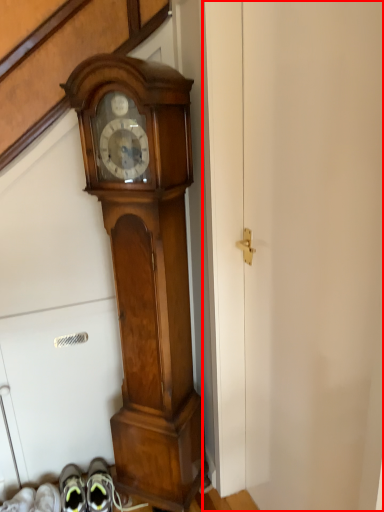
Question: Where is door (annotated by the red box) located in relation to wall clock in the image?

Choices:
 (A) right
 (B) left

Answer: (A)